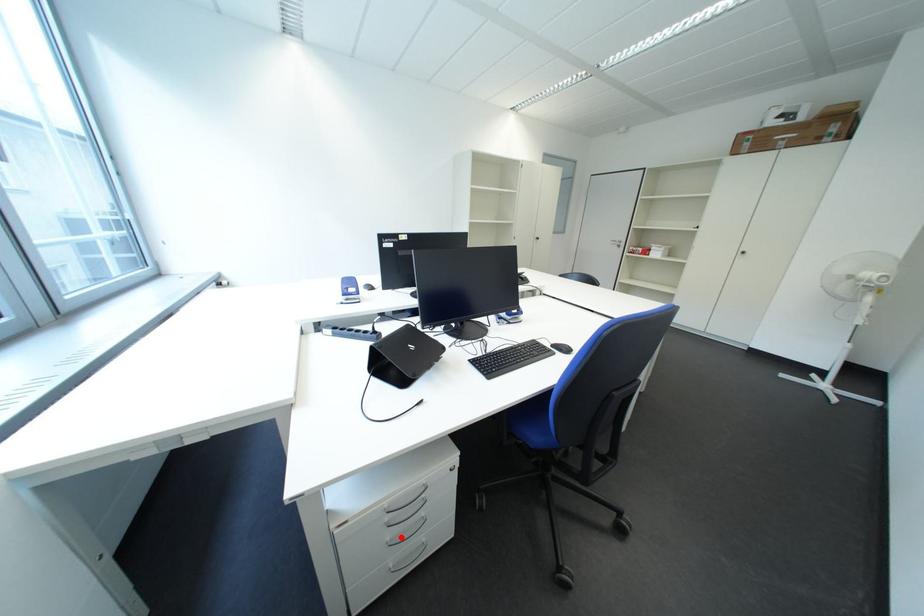
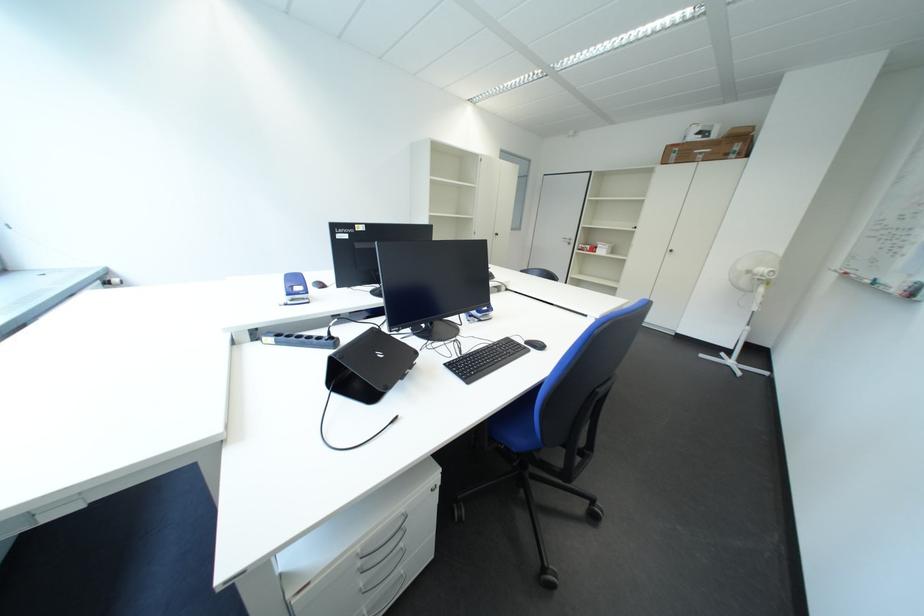
Where in the second image is the point corresponding to the highlighted location from the first image?

(374, 584)